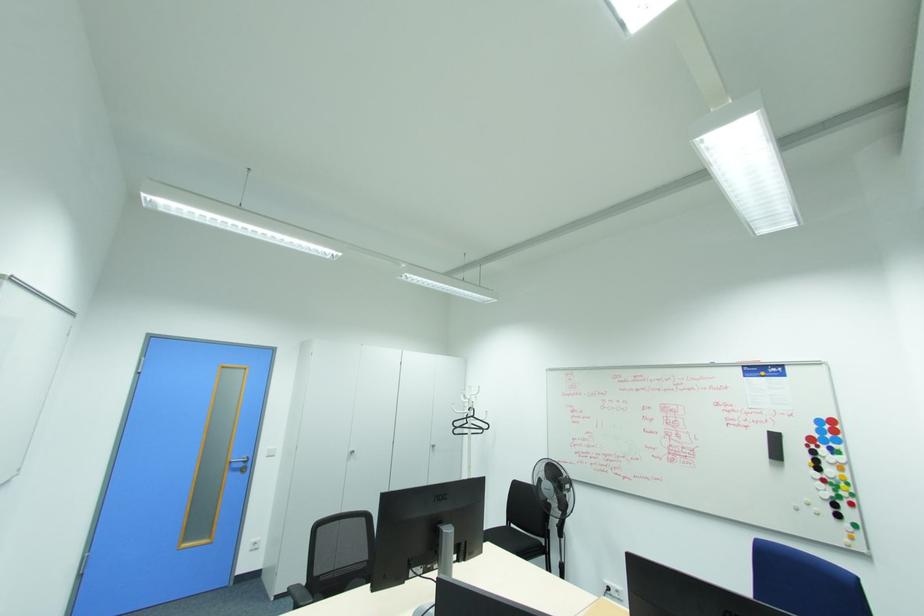
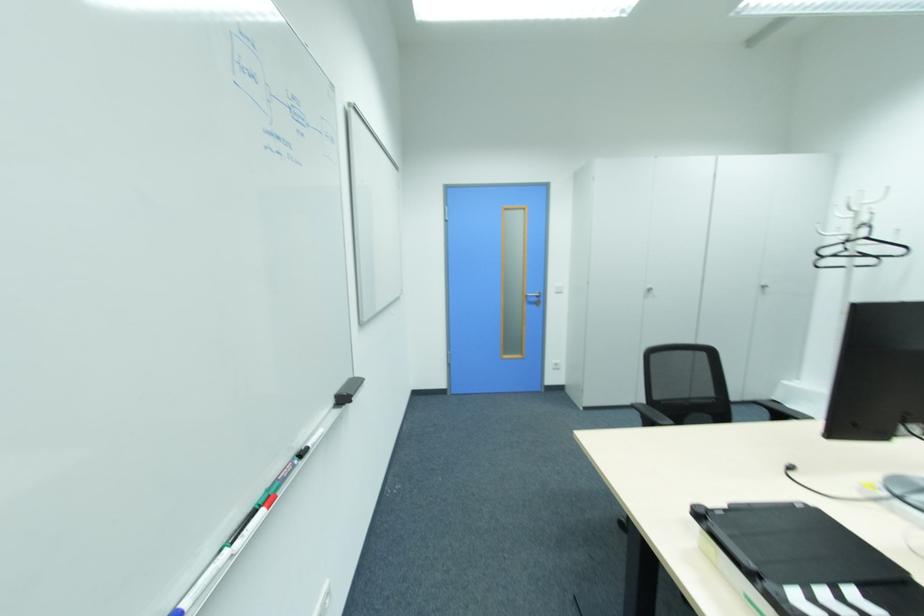
In the second image, find the point that corresponds to point (473, 416) in the first image.

(865, 238)